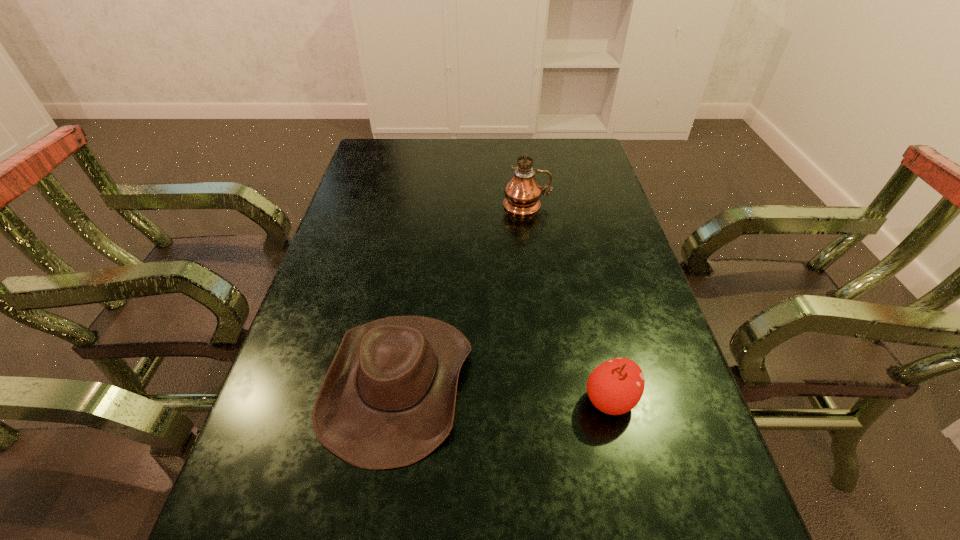
Where is `oil lamp`? The width and height of the screenshot is (960, 540). oil lamp is located at coordinates (522, 192).

At what (x,y) coordinates should I click in order to perform the action: click on the tallest object. Please return your answer as a coordinate pair (x, y). Image resolution: width=960 pixels, height=540 pixels. Looking at the image, I should click on (522, 192).

The width and height of the screenshot is (960, 540). What are the coordinates of `the leftmost object` in the screenshot? It's located at (388, 399).

Where is `apple`? apple is located at coordinates (615, 387).

Identify the location of blank area located 0.320m on the left of the oil lamp. This screenshot has height=540, width=960. (399, 205).

Identify the location of vacant region located on the back of the leftmost object. (424, 215).

This screenshot has width=960, height=540. In order to click on vacant space located 0.210m on the back of the apple in this screenshot , I will do `click(587, 303)`.

Image resolution: width=960 pixels, height=540 pixels. I want to click on object at the left edge, so click(388, 399).

Identify the location of object situated at the right edge. (615, 387).

In the image, there is a desktop. What are the coordinates of `vacant space at the far edge` in the screenshot? It's located at (447, 152).